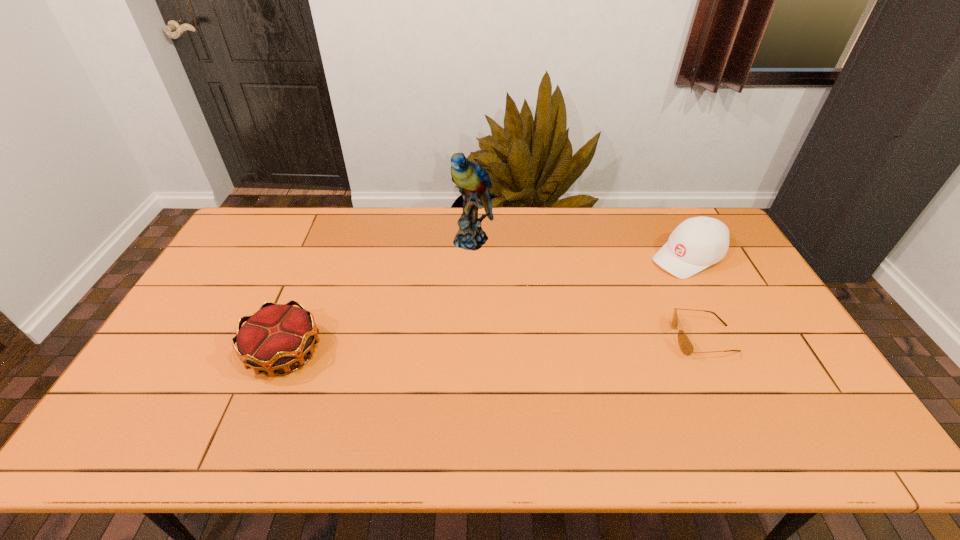
This screenshot has width=960, height=540. Identify the location of the second shortest object. (277, 336).

This screenshot has height=540, width=960. Identify the location of crown. (277, 336).

Find the location of `sunglasses`. sunglasses is located at coordinates (685, 344).

The image size is (960, 540). What are the coordinates of `the third object from right to left` in the screenshot? It's located at (x=472, y=180).

The width and height of the screenshot is (960, 540). I want to click on parrot, so click(472, 180).

Find the location of `the third shortest object`. the third shortest object is located at coordinates (699, 242).

In order to click on vacant space located 0.390m on the back of the leftmost object in this screenshot , I will do `click(329, 240)`.

Where is `vacant space situated 0.370m on the front-facing side of the shortest object`? This screenshot has height=540, width=960. vacant space situated 0.370m on the front-facing side of the shortest object is located at coordinates (541, 339).

Locate an element on the screen. Image resolution: width=960 pixels, height=540 pixels. free location located 0.390m on the front-facing side of the shortest object is located at coordinates (534, 339).

The height and width of the screenshot is (540, 960). In order to click on vacant region located 0.340m on the front-facing side of the shortest object in this screenshot , I will do `click(552, 339)`.